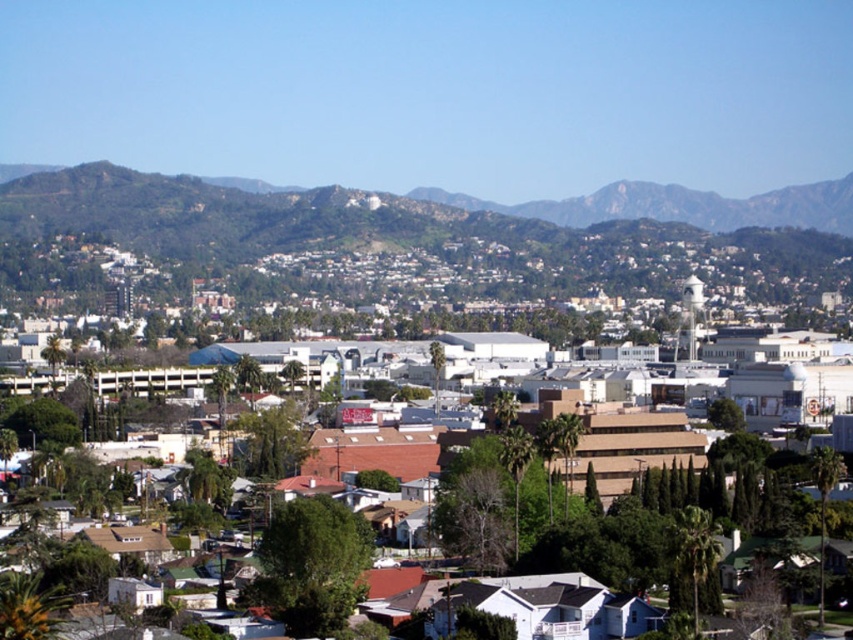
Question: Among these objects, which one is farthest from the camera?

Choices:
 (A) brown matte building at center
 (B) green textured hillside at upper center

Answer: (B)

Question: Is green textured hillside at upper center bigger than brown matte building at center?

Choices:
 (A) yes
 (B) no

Answer: (B)

Question: Among these objects, which one is farthest from the camera?

Choices:
 (A) green textured hillside at upper center
 (B) brown matte building at center

Answer: (A)

Question: Is green textured hillside at upper center to the left of brown matte building at center from the viewer's perspective?

Choices:
 (A) yes
 (B) no

Answer: (B)

Question: Where is green textured hillside at upper center located in relation to brown matte building at center in the image?

Choices:
 (A) above
 (B) below

Answer: (A)